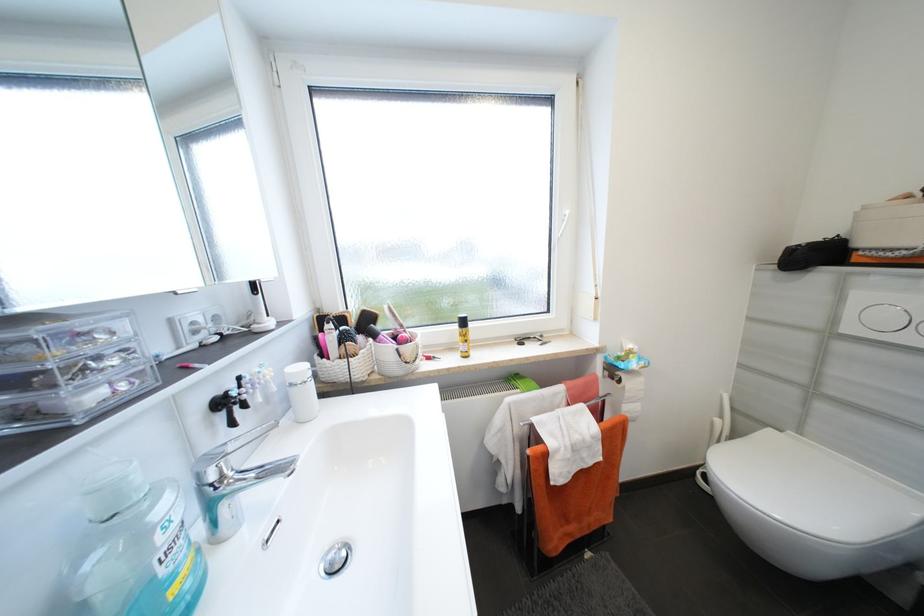
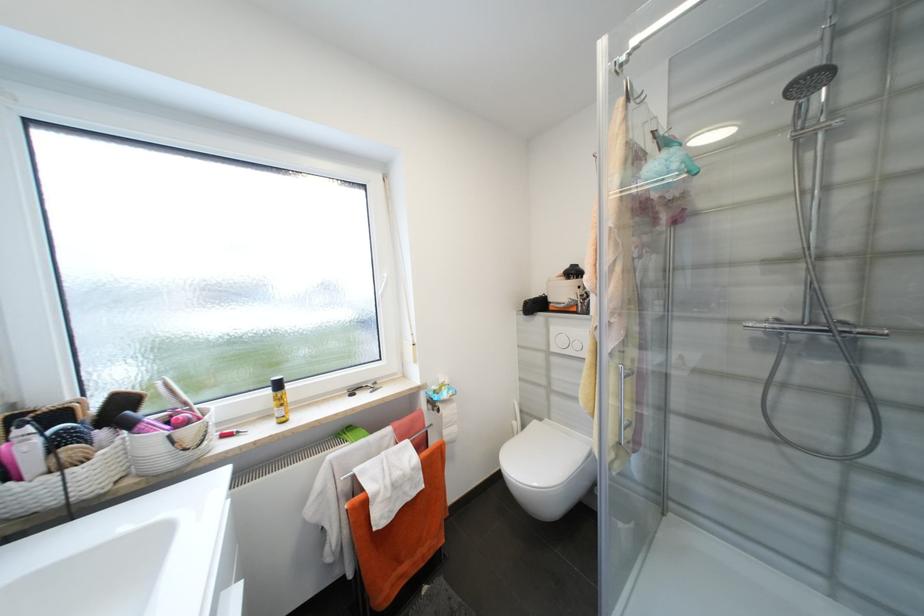
Where in the second image is the point corresponding to pixel 380 336 from the first image?

(134, 427)